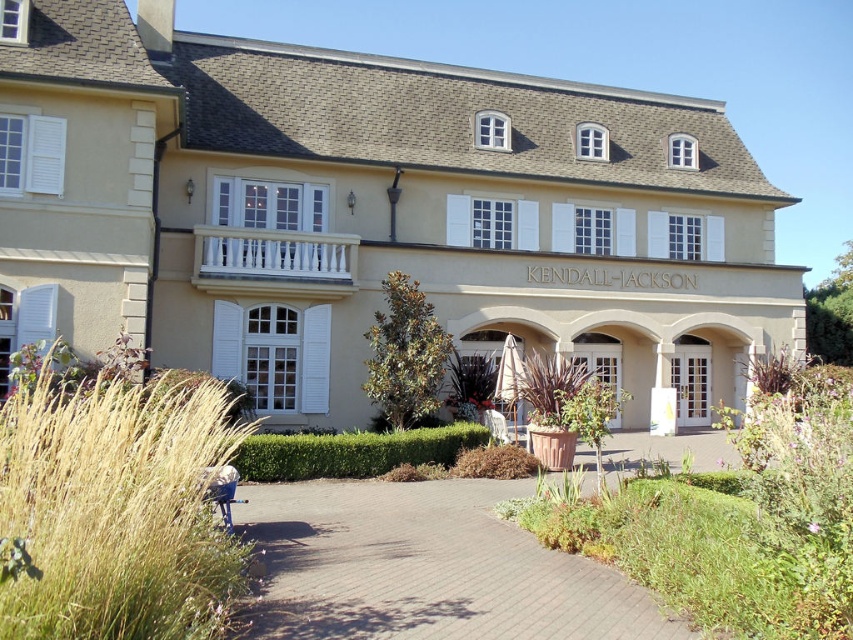
Question: Based on their relative distances, which object is nearer to the paved brick driveway at center?

Choices:
 (A) golden grass at lower left
 (B) beige stucco building at center
 (C) green leafy shrubs at center

Answer: (A)

Question: Can you confirm if golden grass at lower left is smaller than green leafy shrubs at center?

Choices:
 (A) no
 (B) yes

Answer: (B)

Question: Which point is farther to the camera?

Choices:
 (A) (93, 225)
 (B) (27, 468)
 (C) (612, 627)
 (D) (821, 504)

Answer: (A)

Question: Where is beige stucco building at center located in relation to paved brick driveway at center in the image?

Choices:
 (A) right
 (B) left

Answer: (A)

Question: Is beige stucco building at center smaller than paved brick driveway at center?

Choices:
 (A) yes
 (B) no

Answer: (B)

Question: Among these objects, which one is farthest from the camera?

Choices:
 (A) golden grass at lower left
 (B) beige stucco building at center
 (C) green leafy shrubs at center
 (D) paved brick driveway at center

Answer: (B)